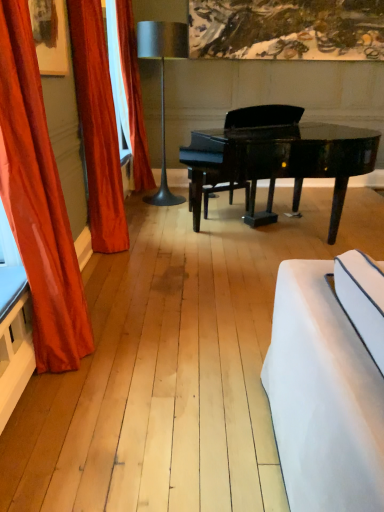
Question: From the image's perspective, is glossy black piano at center above or below metallic gray floor lamp at center?

Choices:
 (A) above
 (B) below

Answer: (B)

Question: Is point [x=291, y=138] closer or farther from the camera than point [x=160, y=22]?

Choices:
 (A) farther
 (B) closer

Answer: (A)

Question: Considering the real-world distances, which object is farthest from the velvet orange curtain at left, which ranks as the 2th curtain in front-to-back order?

Choices:
 (A) orange velvet curtain at left, the first curtain when ordered from back to front
 (B) glossy black piano at center
 (C) satin orange curtain at left, which is the third curtain in back-to-front order
 (D) metallic gray floor lamp at center

Answer: (D)

Question: Which object is the farthest from the velvet orange curtain at left, the second curtain when ordered from back to front?

Choices:
 (A) satin orange curtain at left, the 1th curtain positioned from the front
 (B) glossy black piano at center
 (C) metallic gray floor lamp at center
 (D) orange velvet curtain at left, the 3th curtain in the front-to-back sequence

Answer: (C)